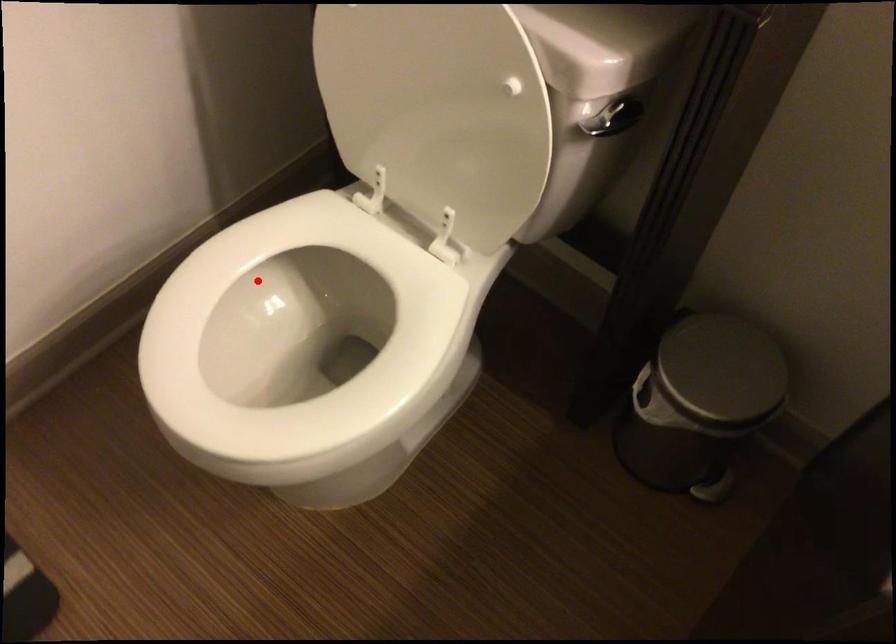
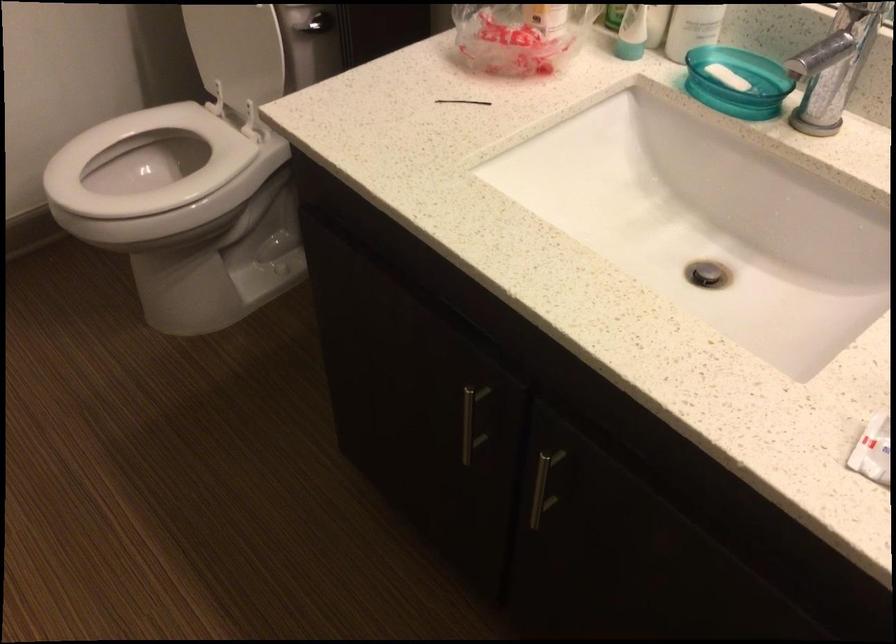
Where in the second image is the point corresponding to the highlighted location from the first image?

(144, 163)